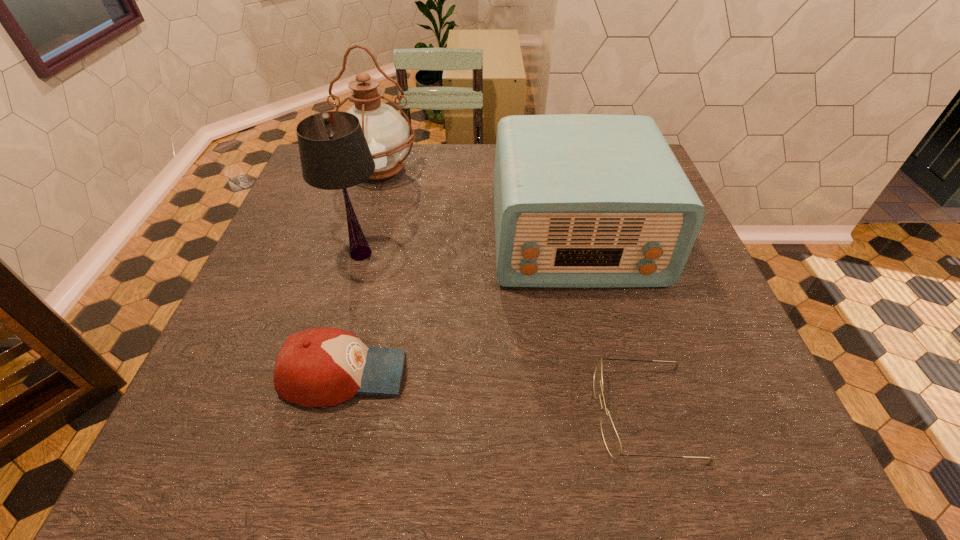
Locate an element on the screen. The height and width of the screenshot is (540, 960). object that is positioned at the near right corner is located at coordinates (611, 439).

Where is `vacant space at the far edge of the desktop`? This screenshot has width=960, height=540. vacant space at the far edge of the desktop is located at coordinates (462, 152).

Image resolution: width=960 pixels, height=540 pixels. In order to click on vacant space at the near edge of the desktop in this screenshot , I will do `click(664, 458)`.

This screenshot has height=540, width=960. In order to click on free point at the left edge in this screenshot , I will do `click(304, 240)`.

Identify the location of vacant point located between the oil lamp and the radio receiver. This screenshot has width=960, height=540. (477, 203).

Where is `vacant point located between the radio receiver and the baseball cap`? vacant point located between the radio receiver and the baseball cap is located at coordinates (459, 306).

I want to click on free space between the baseball cap and the oil lamp, so click(x=362, y=272).

Where is `empty space that is in between the fourth tallest object and the radio receiver`? empty space that is in between the fourth tallest object and the radio receiver is located at coordinates (459, 306).

You are a GUI agent. You are given a task and a screenshot of the screen. Output one action in this format:
    pyautogui.click(x=<x>, y=<y>)
    Task: Click on the vacant point located between the baseball cap and the lampshade
    This screenshot has height=540, width=960.
    Given the screenshot: What is the action you would take?
    pyautogui.click(x=352, y=314)

This screenshot has width=960, height=540. I want to click on vacant space in between the lampshade and the oil lamp, so click(x=371, y=211).